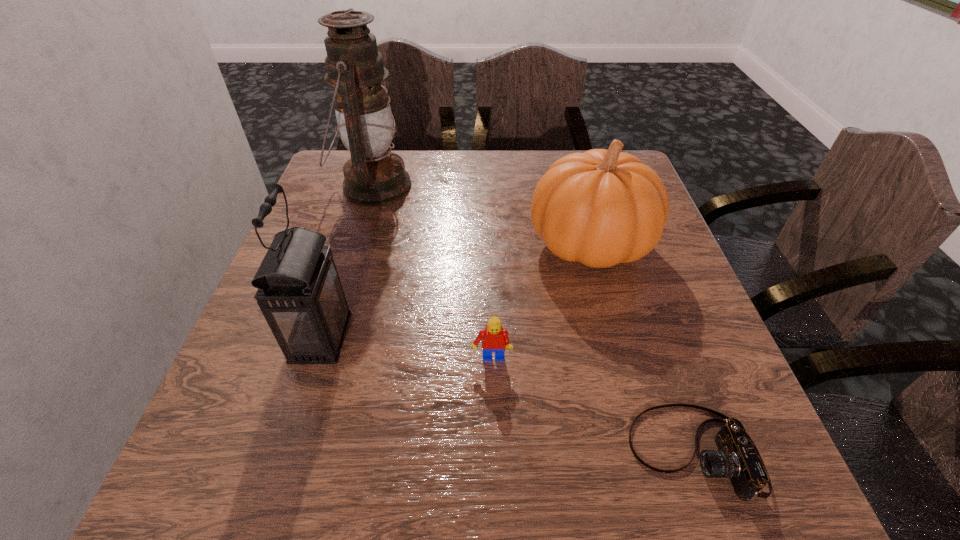
Find the location of `blank region between the Lego and the lantern`. blank region between the Lego and the lantern is located at coordinates (432, 273).

The width and height of the screenshot is (960, 540). Find the location of `free point between the camera and the pumpkin`. free point between the camera and the pumpkin is located at coordinates (641, 348).

I want to click on free space that is in between the pumpkin and the lantern, so click(482, 215).

Image resolution: width=960 pixels, height=540 pixels. Identify the location of free point between the nearest object and the fourth tallest object. (592, 406).

Find the location of a particular element. unoccupied area between the lantern and the pumpkin is located at coordinates (455, 291).

The width and height of the screenshot is (960, 540). Find the location of `vacant area between the fourth shortest object and the pumpkin`. vacant area between the fourth shortest object and the pumpkin is located at coordinates (455, 291).

In order to click on vacant space that's between the tallest object and the nearest object in this screenshot , I will do `click(534, 319)`.

Where is `object that is the closest to the third shortest object`? Image resolution: width=960 pixels, height=540 pixels. object that is the closest to the third shortest object is located at coordinates (494, 339).

Where is `the fourth closest object to the nearest object`? Image resolution: width=960 pixels, height=540 pixels. the fourth closest object to the nearest object is located at coordinates (374, 176).

This screenshot has height=540, width=960. What are the coordinates of `free space in the image that satisfies the following two spatial constraints: 1. on the front side of the lantern; 2. on the front-facing side of the lantern` in the screenshot? It's located at (327, 337).